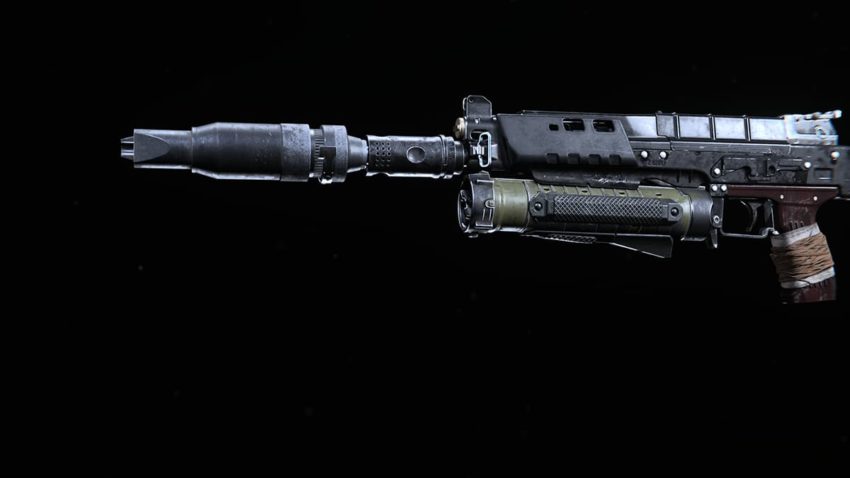
I want to click on screws, so click(677, 214), click(714, 220), click(537, 207).